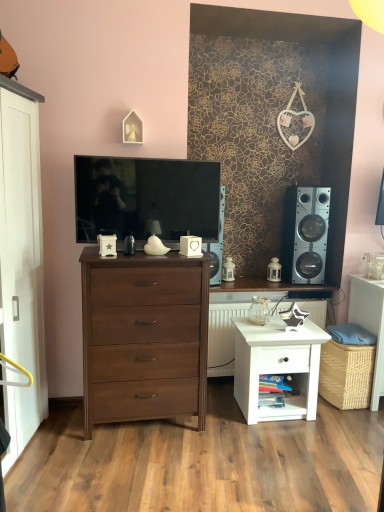
Question: Is dark wood chest of drawers at center located within white glossy radiator at center?

Choices:
 (A) no
 (B) yes

Answer: (A)

Question: Considering the relative sizes of white glossy radiator at center and dark wood chest of drawers at center in the image provided, is white glossy radiator at center shorter than dark wood chest of drawers at center?

Choices:
 (A) yes
 (B) no

Answer: (A)

Question: Is white glossy radiator at center looking in the opposite direction of dark wood chest of drawers at center?

Choices:
 (A) yes
 (B) no

Answer: (B)

Question: Is the position of white glossy radiator at center less distant than that of dark wood chest of drawers at center?

Choices:
 (A) yes
 (B) no

Answer: (B)

Question: Is white glossy radiator at center taller than dark wood chest of drawers at center?

Choices:
 (A) no
 (B) yes

Answer: (A)

Question: Considering the relative positions of silver metallic speaker at right and dark wood chest of drawers at center in the image provided, is silver metallic speaker at right to the left or to the right of dark wood chest of drawers at center?

Choices:
 (A) left
 (B) right

Answer: (B)

Question: Considering the positions of silver metallic speaker at right and dark wood chest of drawers at center in the image, is silver metallic speaker at right bigger or smaller than dark wood chest of drawers at center?

Choices:
 (A) big
 (B) small

Answer: (B)

Question: Is silver metallic speaker at right inside the boundaries of dark wood chest of drawers at center, or outside?

Choices:
 (A) inside
 (B) outside

Answer: (B)

Question: In the image, is silver metallic speaker at right positioned in front of or behind dark wood chest of drawers at center?

Choices:
 (A) front
 (B) behind

Answer: (B)

Question: Is point (312, 266) positioned closer to the camera than point (369, 308)?

Choices:
 (A) closer
 (B) farther

Answer: (B)

Question: From the image's perspective, is silver metallic speaker at right located above or below woven wicker basket at lower right?

Choices:
 (A) below
 (B) above

Answer: (B)

Question: Is silver metallic speaker at right wider or thinner than woven wicker basket at lower right?

Choices:
 (A) wide
 (B) thin

Answer: (B)

Question: Is silver metallic speaker at right bigger or smaller than woven wicker basket at lower right?

Choices:
 (A) small
 (B) big

Answer: (A)

Question: From the image's perspective, is matte black tv at center positioned above or below white glossy nightstand at lower right?

Choices:
 (A) below
 (B) above

Answer: (B)

Question: From a real-world perspective, relative to white glossy nightstand at lower right, is matte black tv at center vertically above or below?

Choices:
 (A) above
 (B) below

Answer: (A)